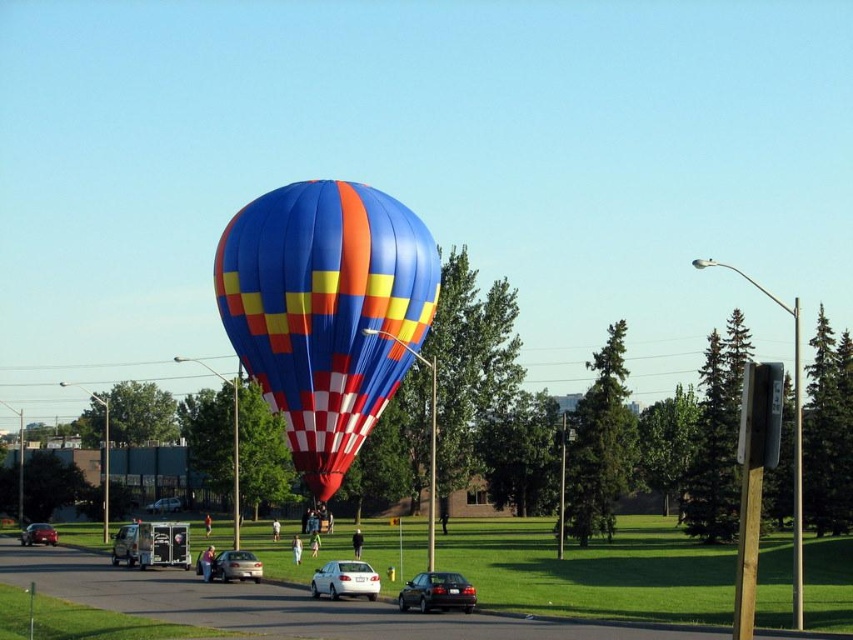
Question: Where is shiny black sedan at center located in relation to silver metallic sedan at center in the image?

Choices:
 (A) right
 (B) left

Answer: (A)

Question: Is the position of silver metallic sedan at center less distant than that of silver metallic car at center?

Choices:
 (A) yes
 (B) no

Answer: (A)

Question: Among these points, which one is nearest to the camera?

Choices:
 (A) (302, 330)
 (B) (434, 584)
 (C) (35, 541)
 (D) (172, 499)

Answer: (B)

Question: Can you confirm if blue glossy hot air balloon at center is positioned to the right of white matte sedan at center?

Choices:
 (A) yes
 (B) no

Answer: (B)

Question: Among these objects, which one is farthest from the camera?

Choices:
 (A) white matte sedan at center
 (B) blue glossy hot air balloon at center

Answer: (B)

Question: Estimate the real-world distances between objects in this image. Which object is farther from the shiny black sedan at center?

Choices:
 (A) metallic gray pole at right
 (B) blue glossy hot air balloon at center
 (C) white matte sedan at center

Answer: (A)